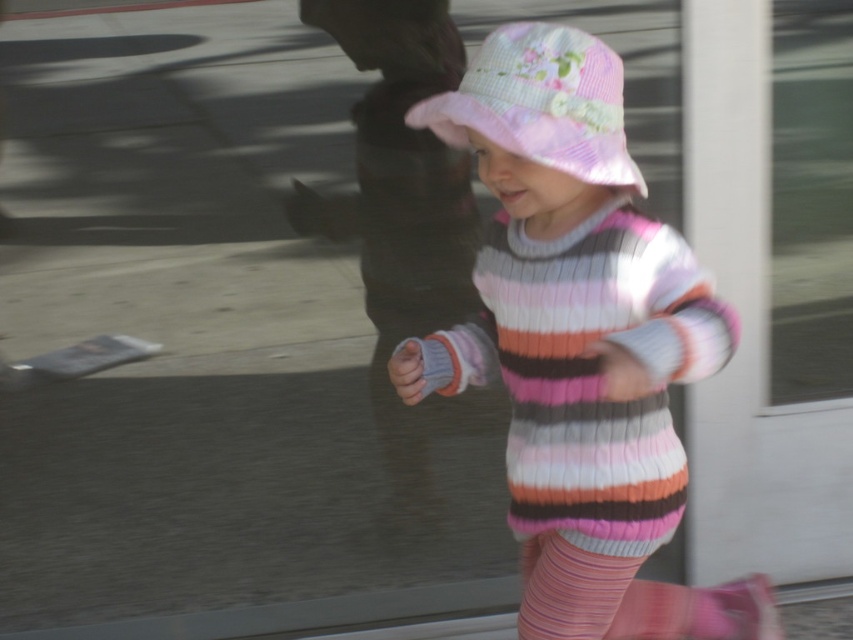
The child is wearing a pink striped sweater at center and a pink seersucker hat at center. Which clothing item is positioned more to the right?

The pink striped sweater at center is positioned to the right of the pink seersucker hat at center.

You are taking a photo of the child wearing the pink striped sweater at center. If your camera is 6.32 feet away from the sweater, is it within the recommended 5 feet for clear facial recognition? Explain.

The camera is 6.32 feet away from the pink striped sweater at center, which exceeds the recommended 5 feet for clear facial recognition. Therefore, the distance is too far for clear facial recognition.

You are a fashion designer observing the child in the image. You need to determine which item of clothing has a greater width between the pink striped sweater at center and the pink seersucker hat at center. Which one is wider?

The pink striped sweater at center is wider than the pink seersucker hat at center according to the description.